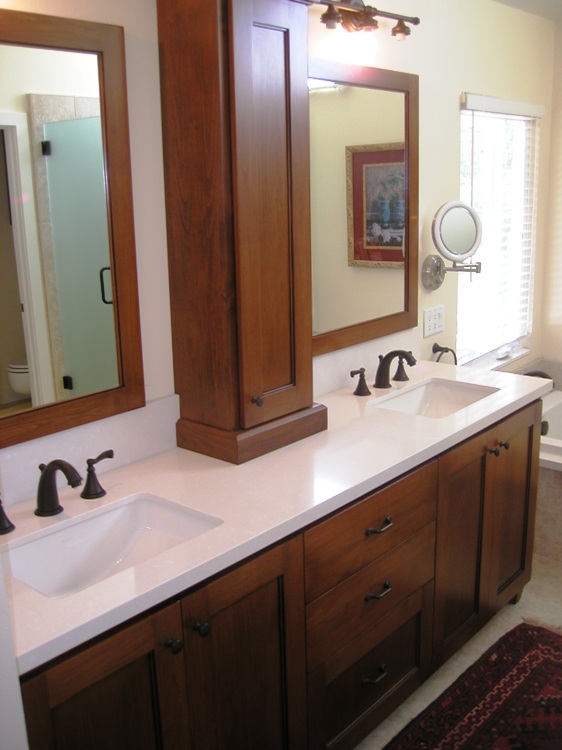
Where is `rug`? rug is located at coordinates (538, 690).